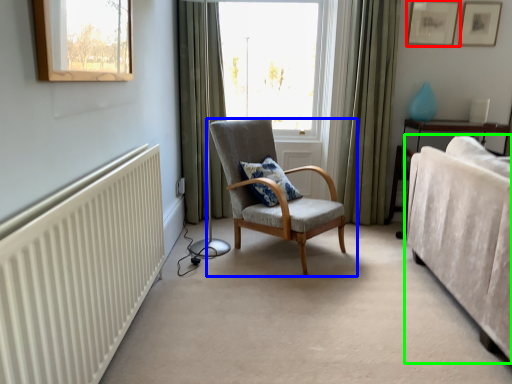
Question: Estimate the real-world distances between objects in this image. Which object is closer to picture frame (highlighted by a red box), chair (highlighted by a blue box) or studio couch (highlighted by a green box)?

Choices:
 (A) chair
 (B) studio couch

Answer: (B)